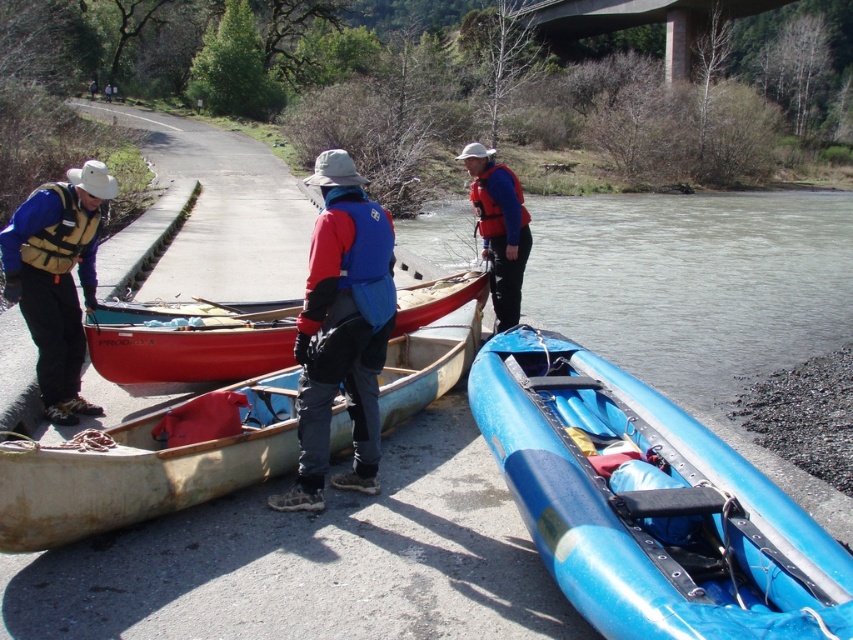
You are standing at the point marked by coordinates point [57,278]. Which object is located exactly at this point?

The point [57,278] corresponds to the location of the matte yellow life vest at left.